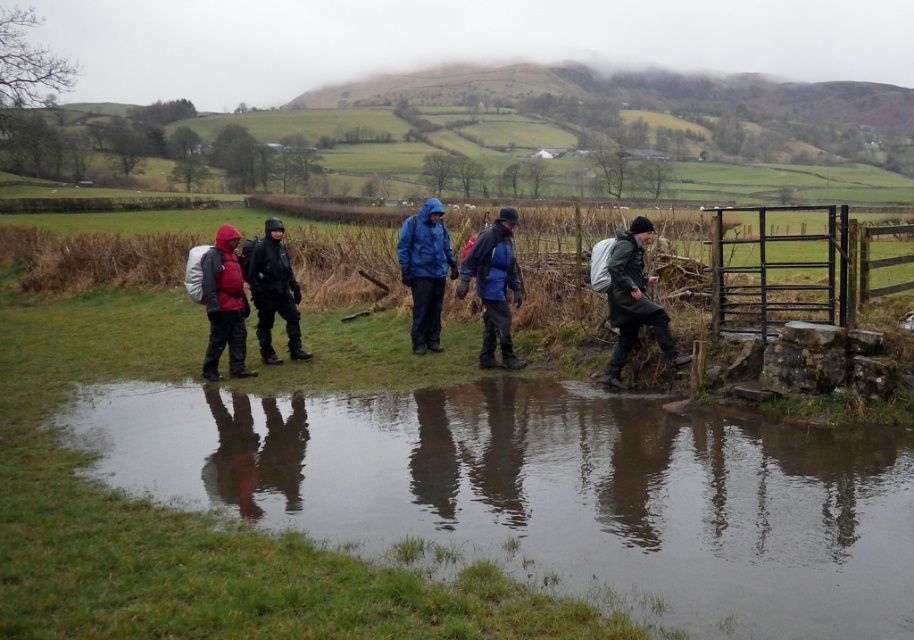
Does point (460, 291) lie behind point (257, 257)?

No, (460, 291) is in front of (257, 257).

Which of these two, blue matte jacket at center or matte black jacket at center, stands shorter?

With less height is matte black jacket at center.

Is point (497, 260) positioned after point (250, 248)?

No, (497, 260) is in front of (250, 248).

Where is `blue matte jacket at center`? The image size is (914, 640). blue matte jacket at center is located at coordinates (493, 285).

Between point (645, 221) and point (497, 234), which one is positioned in front?

Point (645, 221) is in front.

Between dark green waterproof jacket at right and blue matte jacket at center, which one has more height?

blue matte jacket at center

Which is behind, point (643, 259) or point (492, 300)?

Point (492, 300)

Identify the location of dark green waterproof jacket at right. The image size is (914, 640). (634, 301).

Is matte blue jacket at center in front of matte black jacket at center?

That is False.

Describe the element at coordinates (424, 272) in the screenshot. I see `matte blue jacket at center` at that location.

Between point (434, 259) and point (253, 300), which one is positioned in front?

Point (434, 259) is in front.

You are a GUI agent. You are given a task and a screenshot of the screen. Output one action in this format:
    pyautogui.click(x=<x>, y=<y>)
    Task: Click on the matte blue jacket at center
    
    Given the screenshot: What is the action you would take?
    pyautogui.click(x=424, y=272)